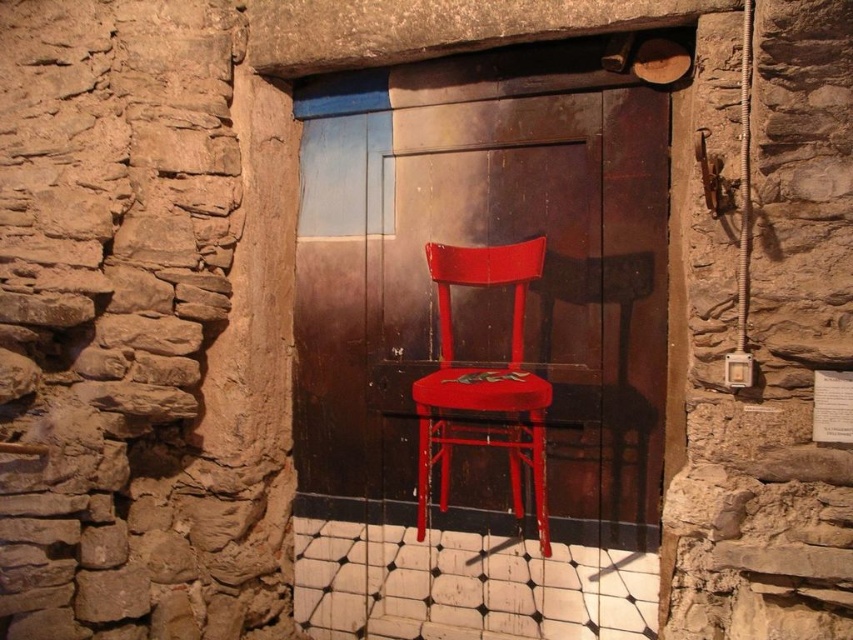
You are standing in the rustic interior space with stone walls and a tiled floor. You see a red chair in front of a door with a reflective surface at center. Where is the point at coordinates point (482, 244) located?

The point at coordinates point (482, 244) is located on the matte wood door at center.

You are standing in the rustic room and want to sit on the matte red chair at center. To your left is the matte wood door at center. Which direction should you move to reach the chair?

The matte wood door at center is to the left of the matte red chair at center, so you should move to your right to reach the matte red chair at center.

You are standing in the rustic interior space and want to know which object is taller between the matte wood door at center and the matte red chair at center. Can you determine which one is taller?

The matte wood door at center is taller than the matte red chair at center according to the description.